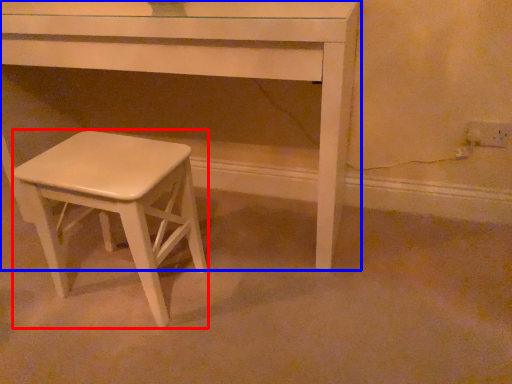
Question: Which of the following is the farthest to the observer, stool (highlighted by a red box) or table (highlighted by a blue box)?

Choices:
 (A) stool
 (B) table

Answer: (B)